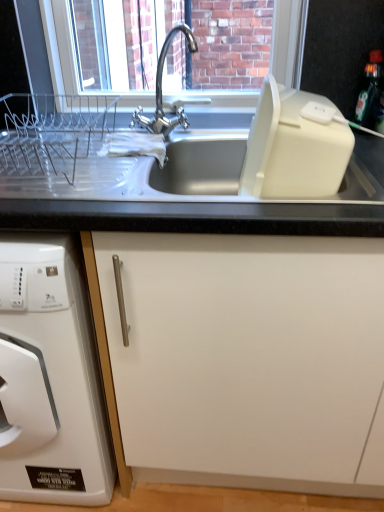
The image size is (384, 512). Describe the element at coordinates (161, 90) in the screenshot. I see `chrome metallic faucet at upper center` at that location.

Find the location of a particular element. The width and height of the screenshot is (384, 512). clear glass window screen at upper center is located at coordinates (173, 51).

Is clear glass window screen at upper center closer to the viewer compared to chrome metallic faucet at upper center?

No, clear glass window screen at upper center is behind chrome metallic faucet at upper center.

From the image's perspective, which is above, clear glass window screen at upper center or chrome metallic faucet at upper center?

clear glass window screen at upper center, from the image's perspective.

Considering the positions of points (303, 32) and (167, 45), is point (303, 32) closer to camera compared to point (167, 45)?

Yes, point (303, 32) is closer to viewer.

Locate an element on the screen. window screen located above the chrome metallic faucet at upper center (from the image's perspective) is located at coordinates (173, 51).

Which is more to the right, chrome metallic faucet at upper center or clear glass window screen at upper center?

clear glass window screen at upper center is more to the right.

In terms of height, does chrome metallic faucet at upper center look taller or shorter compared to clear glass window screen at upper center?

Clearly, chrome metallic faucet at upper center is shorter compared to clear glass window screen at upper center.

Could you tell me if chrome metallic faucet at upper center is facing clear glass window screen at upper center?

No, chrome metallic faucet at upper center is not oriented towards clear glass window screen at upper center.

From the image's perspective, is chrome metallic faucet at upper center on clear glass window screen at upper center?

Actually, chrome metallic faucet at upper center appears below clear glass window screen at upper center in the image.

Does black glossy bottle at upper right have a smaller size compared to clear glass window screen at upper center?

Correct, black glossy bottle at upper right occupies less space than clear glass window screen at upper center.

Is black glossy bottle at upper right next to clear glass window screen at upper center?

No, black glossy bottle at upper right is not making contact with clear glass window screen at upper center.

Which is more to the left, black glossy bottle at upper right or clear glass window screen at upper center?

clear glass window screen at upper center is more to the left.

From their relative heights in the image, would you say chrome metallic faucet at upper center is taller or shorter than black glossy bottle at upper right?

Considering their sizes, chrome metallic faucet at upper center has more height than black glossy bottle at upper right.

Where is `tap above the black glossy bottle at upper right (from the image's perspective)`? tap above the black glossy bottle at upper right (from the image's perspective) is located at coordinates (161, 90).

From the picture: From the image's perspective, is chrome metallic faucet at upper center located beneath black glossy bottle at upper right?

No, from the image's perspective, chrome metallic faucet at upper center is not below black glossy bottle at upper right.

Is chrome metallic faucet at upper center oriented towards white matte cabinet at center?

No, chrome metallic faucet at upper center is not turned towards white matte cabinet at center.

From the image's perspective, between chrome metallic faucet at upper center and white matte cabinet at center, who is located below?

white matte cabinet at center appears lower in the image.

From a real-world perspective, is chrome metallic faucet at upper center above or below white matte cabinet at center?

chrome metallic faucet at upper center is above white matte cabinet at center.

How different are the orientations of chrome metallic faucet at upper center and white matte cabinet at center in degrees?

1.2 degrees separate the facing orientations of chrome metallic faucet at upper center and white matte cabinet at center.

Consider the image. From the image's perspective, which is below, clear glass window screen at upper center or white plastic dish rack at left?

white plastic dish rack at left.

In the scene shown: Is white plastic dish rack at left located within clear glass window screen at upper center?

Actually, white plastic dish rack at left is outside clear glass window screen at upper center.

Who is taller, clear glass window screen at upper center or white plastic dish rack at left?

white plastic dish rack at left.

In terms of width, does clear glass window screen at upper center look wider or thinner when compared to white plastic dish rack at left?

In the image, clear glass window screen at upper center appears to be more narrow than white plastic dish rack at left.

Could you tell me if white plastic dish rack at left is turned towards white matte cabinet at center?

No, white plastic dish rack at left is not oriented towards white matte cabinet at center.

In the scene shown: How different are the orientations of white plastic dish rack at left and white matte cabinet at center in degrees?

They differ by 1.5 degrees in their facing directions.

From the image's perspective, between white plastic dish rack at left and white matte cabinet at center, which one is located above?

white plastic dish rack at left appears higher in the image.

Is white plastic dish rack at left not close to white matte cabinet at center?

white plastic dish rack at left is near white matte cabinet at center, not far away.

What are the coordinates of `window screen positioned vertically above the chrome metallic faucet at upper center (from a real-world perspective)` in the screenshot? It's located at (173, 51).

In order to click on tap below the clear glass window screen at upper center (from a real-world perspective) in this screenshot , I will do `click(161, 90)`.

Which object lies further to the anchor point white plastic dish rack at left, black glossy bottle at upper right or clear glass window screen at upper center?

clear glass window screen at upper center is further to white plastic dish rack at left.

Looking at this image, considering their positions, is black glossy bottle at upper right positioned further to clear glass window screen at upper center than chrome metallic faucet at upper center?

The object further to clear glass window screen at upper center is black glossy bottle at upper right.

Estimate the real-world distances between objects in this image. Which object is closer to white plastic dish rack at left, chrome metallic faucet at upper center or white matte cabinet at center?

The object closer to white plastic dish rack at left is white matte cabinet at center.

Based on their spatial positions, is clear glass window screen at upper center or white matte cabinet at center further from white plastic dish rack at left?

The object further to white plastic dish rack at left is clear glass window screen at upper center.

Based on their spatial positions, is white plastic dish rack at left or chrome metallic faucet at upper center closer to clear glass window screen at upper center?

The object closer to clear glass window screen at upper center is chrome metallic faucet at upper center.

When comparing their distances from black glossy bottle at upper right, does chrome metallic faucet at upper center or white matte cabinet at center seem further?

Among the two, white matte cabinet at center is located further to black glossy bottle at upper right.

When comparing their distances from white matte cabinet at center, does black glossy bottle at upper right or white plastic dish rack at left seem closer?

white plastic dish rack at left lies closer to white matte cabinet at center than the other object.

Based on the photo, based on their spatial positions, is clear glass window screen at upper center or chrome metallic faucet at upper center further from white matte cabinet at center?

clear glass window screen at upper center.

Where is `window screen between white plastic dish rack at left and black glossy bottle at upper right in the horizontal direction`? Image resolution: width=384 pixels, height=512 pixels. window screen between white plastic dish rack at left and black glossy bottle at upper right in the horizontal direction is located at coordinates (173, 51).

The width and height of the screenshot is (384, 512). Find the location of `tap between white plastic dish rack at left and white matte cabinet at center`. tap between white plastic dish rack at left and white matte cabinet at center is located at coordinates (161, 90).

Find the location of a particular element. tap situated between white plastic dish rack at left and black glossy bottle at upper right from left to right is located at coordinates (161, 90).

Locate an element on the screen. window screen between chrome metallic faucet at upper center and black glossy bottle at upper right is located at coordinates (173, 51).